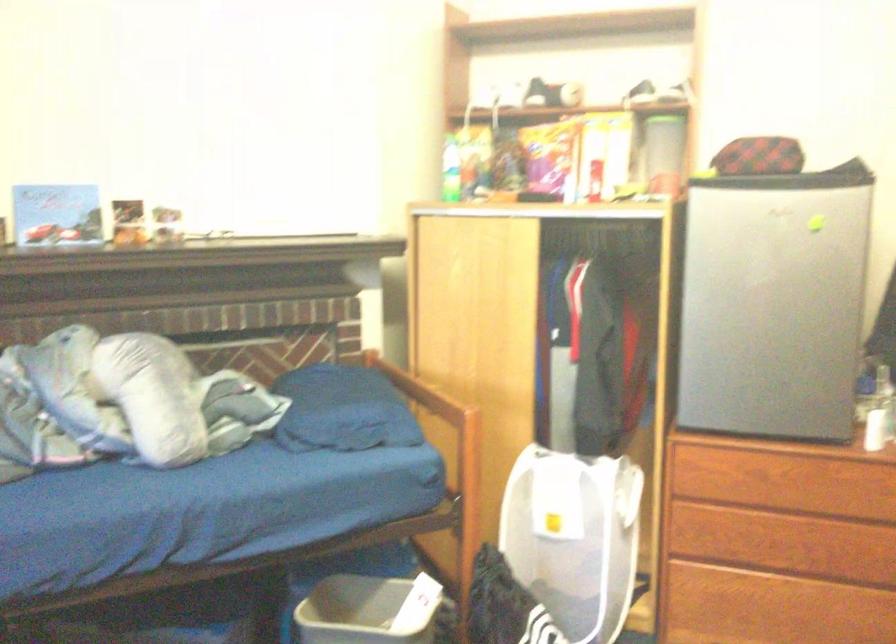
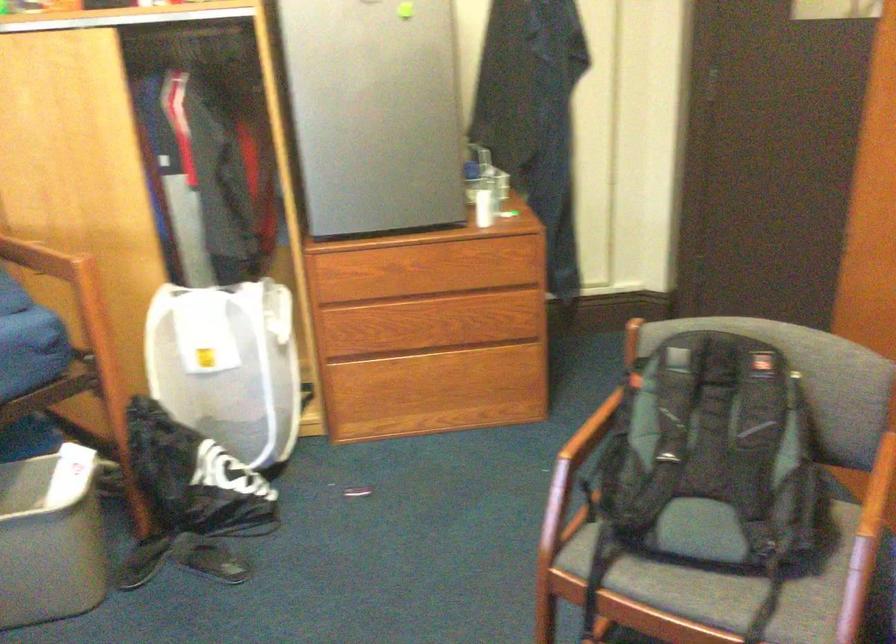
Question: Based on the continuous images, in which direction is the camera rotating? Reply with the corresponding letter.

Choices:
 (A) Left
 (B) Right
 (C) Up
 (D) Down

Answer: (B)